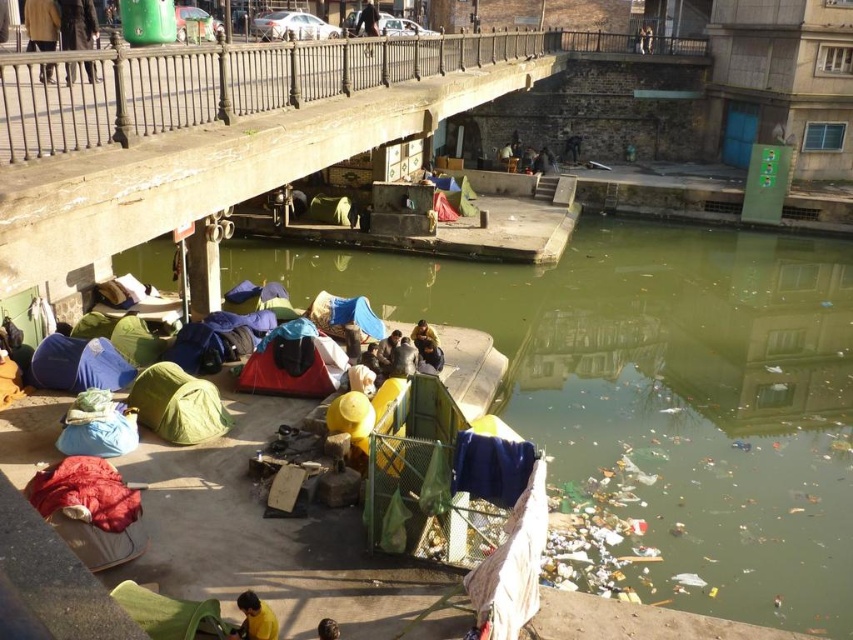
Question: Which of the following is the closest to the observer?

Choices:
 (A) (250, 628)
 (B) (50, 33)

Answer: (A)

Question: Does dark brown leather jacket at upper left lie behind yellow matte jacket at lower center?

Choices:
 (A) yes
 (B) no

Answer: (A)

Question: Is rusty metal dock at center wider than brown leather jacket at upper left?

Choices:
 (A) no
 (B) yes

Answer: (B)

Question: Considering the relative positions of dark brown leather jacket at upper left and dark blue fabric at center in the image provided, where is dark brown leather jacket at upper left located with respect to dark blue fabric at center?

Choices:
 (A) above
 (B) below

Answer: (B)

Question: Which point is farther to the camera?

Choices:
 (A) (247, 632)
 (B) (538, 157)

Answer: (B)

Question: Which point is farther from the camera taking this photo?

Choices:
 (A) (55, 4)
 (B) (67, 8)
 (C) (527, 196)

Answer: (C)